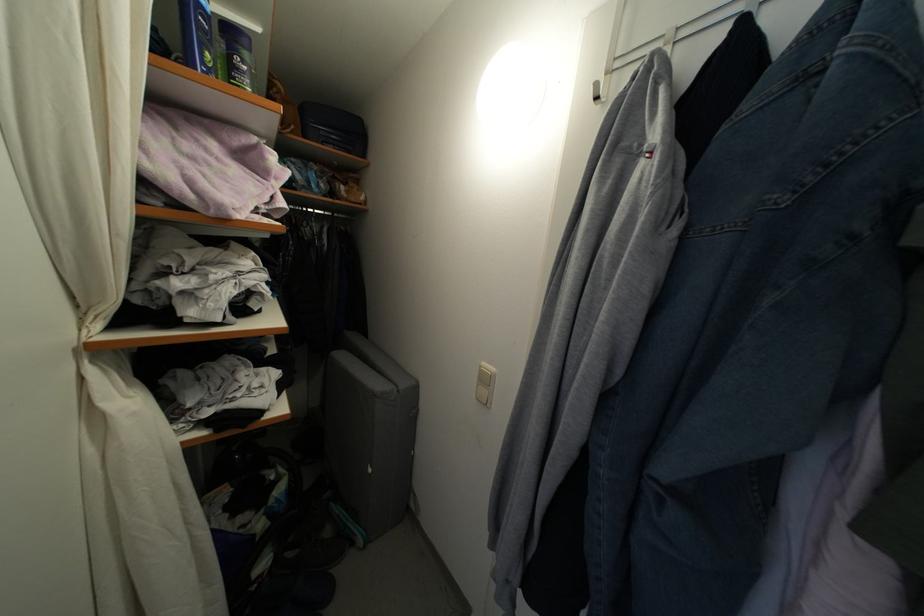
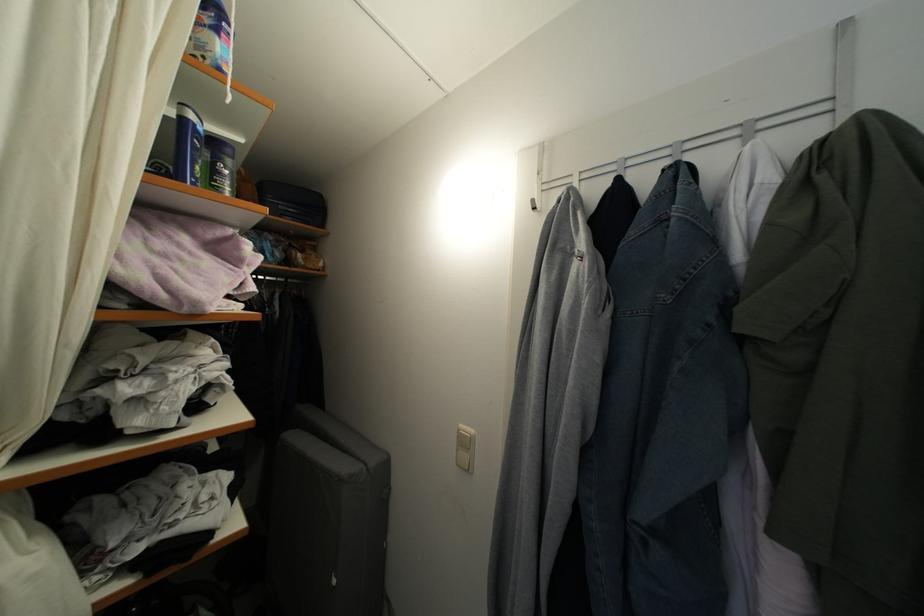
Locate, in the second image, the point that corresponds to pixel 489 370 in the first image.

(467, 432)